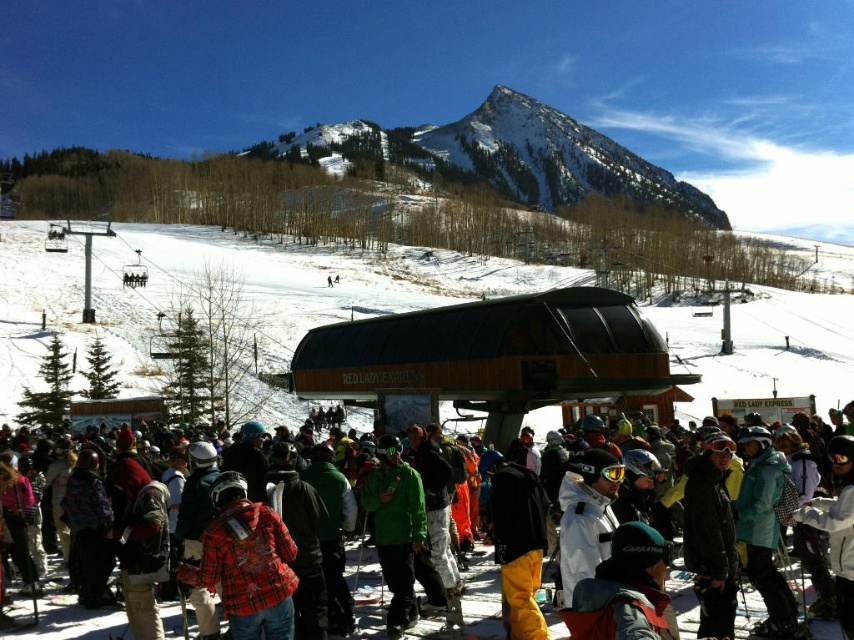
Question: Which object appears farthest from the camera in this image?

Choices:
 (A) white powdery snow at center
 (B) snowy granite mountain at upper center

Answer: (B)

Question: Which of the following is the closest to the observer?

Choices:
 (A) (33, 284)
 (B) (492, 604)

Answer: (B)

Question: Which point is closer to the camera?

Choices:
 (A) (512, 90)
 (B) (121, 630)

Answer: (B)

Question: Considering the relative positions of white powdery snow at center and plaid jacket at center in the image provided, where is white powdery snow at center located with respect to plaid jacket at center?

Choices:
 (A) right
 (B) left

Answer: (A)

Question: Does plaid jacket at center appear over plaid fabric jacket at center?

Choices:
 (A) no
 (B) yes

Answer: (A)

Question: Is white powdery snow at center smaller than plaid fabric jacket at center?

Choices:
 (A) no
 (B) yes

Answer: (A)